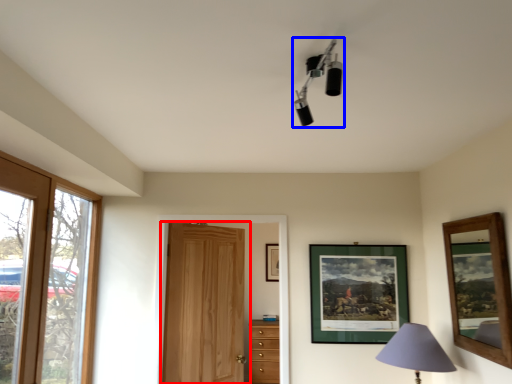
Question: Which point is further to the camera, door (highlighted by a red box) or lamp (highlighted by a blue box)?

Choices:
 (A) door
 (B) lamp

Answer: (A)